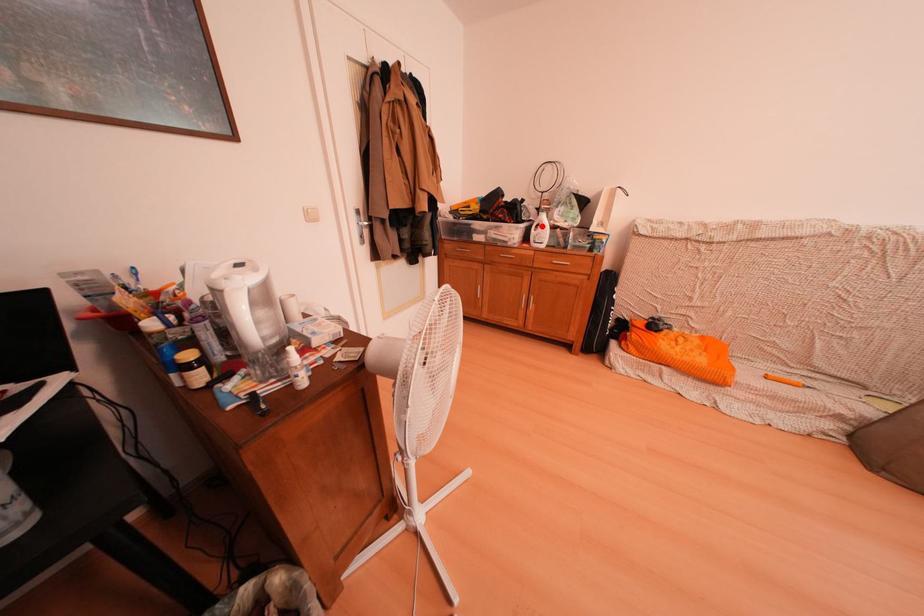
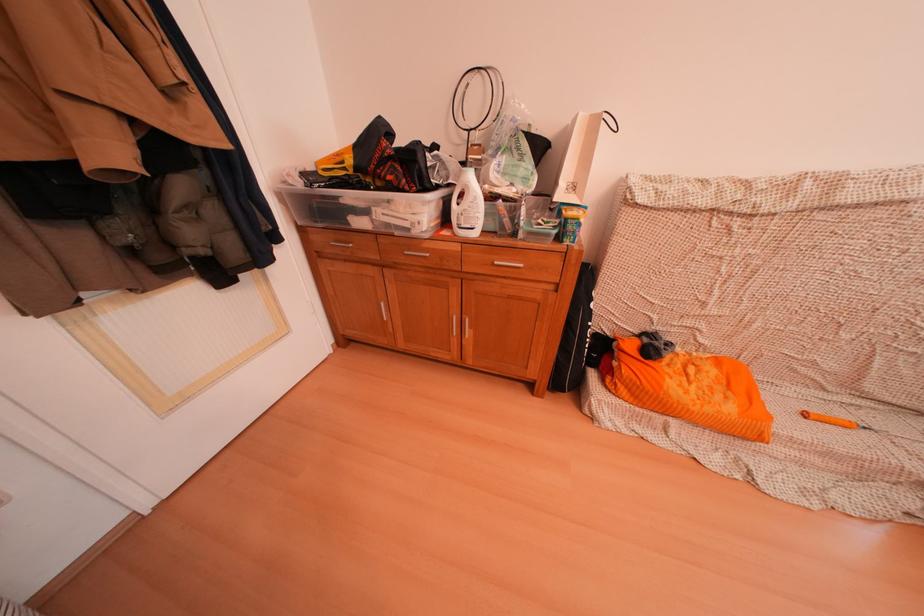
Locate, in the second image, the point that corresponds to the highlighted location in the first image.

(462, 190)